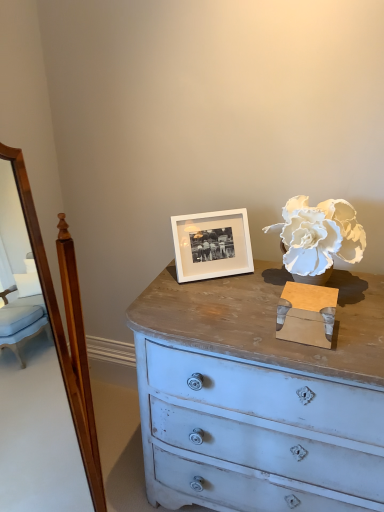
Question: Considering the positions of white paper flower at upper right and white matte picture frame at center in the image, is white paper flower at upper right taller or shorter than white matte picture frame at center?

Choices:
 (A) short
 (B) tall

Answer: (B)

Question: Would you say white paper flower at upper right is to the left or to the right of white matte picture frame at center in the picture?

Choices:
 (A) left
 (B) right

Answer: (B)

Question: In terms of size, does white paper flower at upper right appear bigger or smaller than white matte picture frame at center?

Choices:
 (A) small
 (B) big

Answer: (B)

Question: Does point (251, 263) appear closer or farther from the camera than point (302, 258)?

Choices:
 (A) farther
 (B) closer

Answer: (A)

Question: Is white matte picture frame at center bigger or smaller than white paper flower at upper right?

Choices:
 (A) big
 (B) small

Answer: (B)

Question: From the image's perspective, is white matte picture frame at center positioned above or below white paper flower at upper right?

Choices:
 (A) above
 (B) below

Answer: (B)

Question: Considering their positions, is white matte picture frame at center located in front of or behind white paper flower at upper right?

Choices:
 (A) behind
 (B) front

Answer: (A)